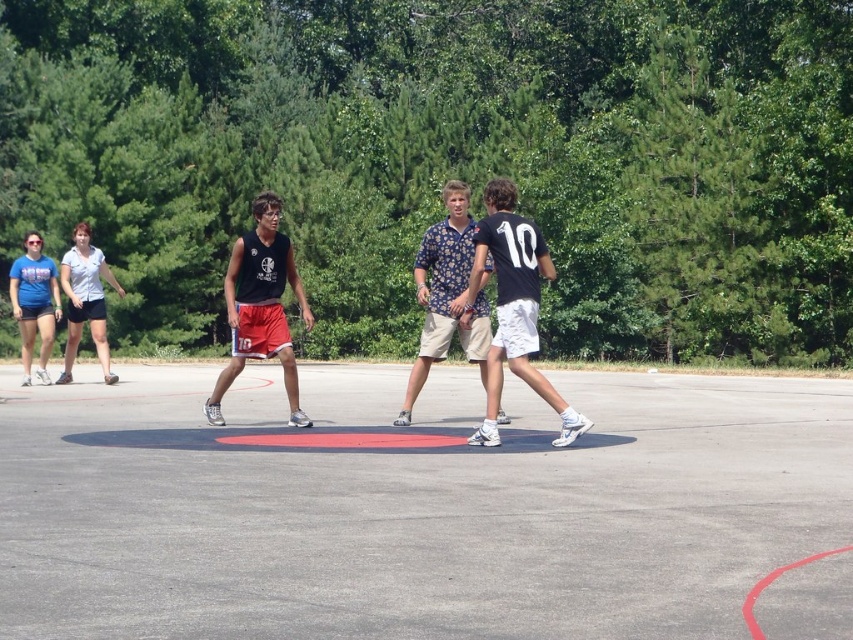
Question: Can you confirm if black matte jersey at center is thinner than floral-patterned shirt at center?

Choices:
 (A) yes
 (B) no

Answer: (A)

Question: Estimate the real-world distances between objects in this image. Which object is closer to the matte black tank top at center?

Choices:
 (A) black matte jersey at center
 (B) matte blue t-shirt at left
 (C) floral-patterned shirt at center
 (D) gray concrete court at center

Answer: (C)

Question: Is floral-patterned shirt at center above matte blue t-shirt at left?

Choices:
 (A) no
 (B) yes

Answer: (B)

Question: Can you confirm if black matte jersey at center is positioned below floral-patterned shirt at center?

Choices:
 (A) no
 (B) yes

Answer: (B)

Question: Which object is the closest to the black matte jersey at center?

Choices:
 (A) floral-patterned shirt at center
 (B) matte blue t-shirt at left
 (C) gray concrete court at center

Answer: (A)

Question: Based on their relative distances, which object is nearer to the matte black tank top at center?

Choices:
 (A) black matte jersey at center
 (B) gray concrete court at center
 (C) floral-patterned shirt at center
 (D) matte blue t-shirt at left

Answer: (C)